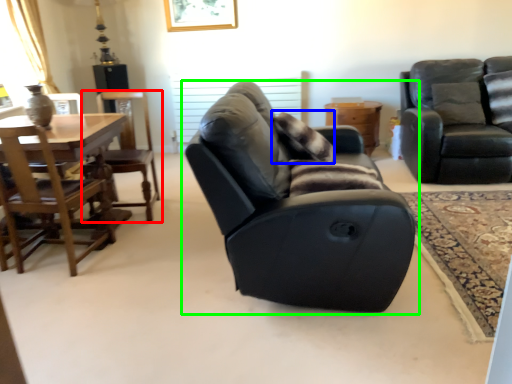
Question: Estimate the real-world distances between objects in this image. Which object is closer to chair (highlighted by a red box), pillow (highlighted by a blue box) or chair (highlighted by a green box)?

Choices:
 (A) pillow
 (B) chair

Answer: (A)